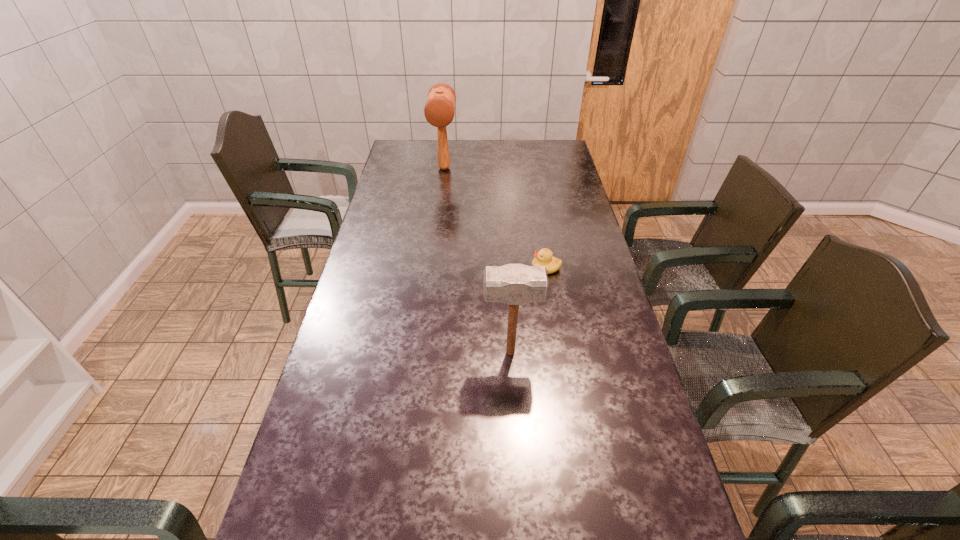
This screenshot has height=540, width=960. I want to click on the farther mallet, so click(439, 111).

The width and height of the screenshot is (960, 540). I want to click on the tallest object, so click(x=439, y=111).

Identify the location of the second object from right to left. This screenshot has height=540, width=960. (514, 284).

At what (x,y) coordinates should I click in order to perform the action: click on the nearest object. Please return your answer as a coordinate pair (x, y). Looking at the image, I should click on (514, 284).

Where is `duckling`? This screenshot has height=540, width=960. duckling is located at coordinates (544, 257).

Locate an element on the screen. the second farthest object is located at coordinates (544, 257).

Locate an element on the screen. This screenshot has width=960, height=540. free space located 0.270m on the strike surface of the leftmost object is located at coordinates (439, 213).

In order to click on vacant space located on the striking face of the second tallest object in this screenshot , I will do `click(395, 353)`.

This screenshot has height=540, width=960. I want to click on free region located on the striking face of the second tallest object, so click(444, 353).

What are the coordinates of `vacant region located on the striking face of the second tallest object` in the screenshot? It's located at (462, 353).